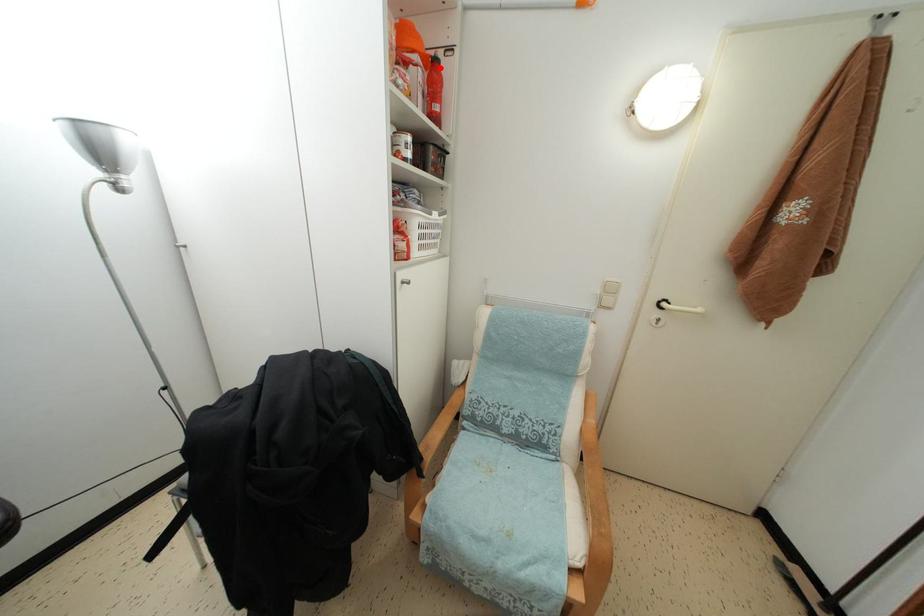
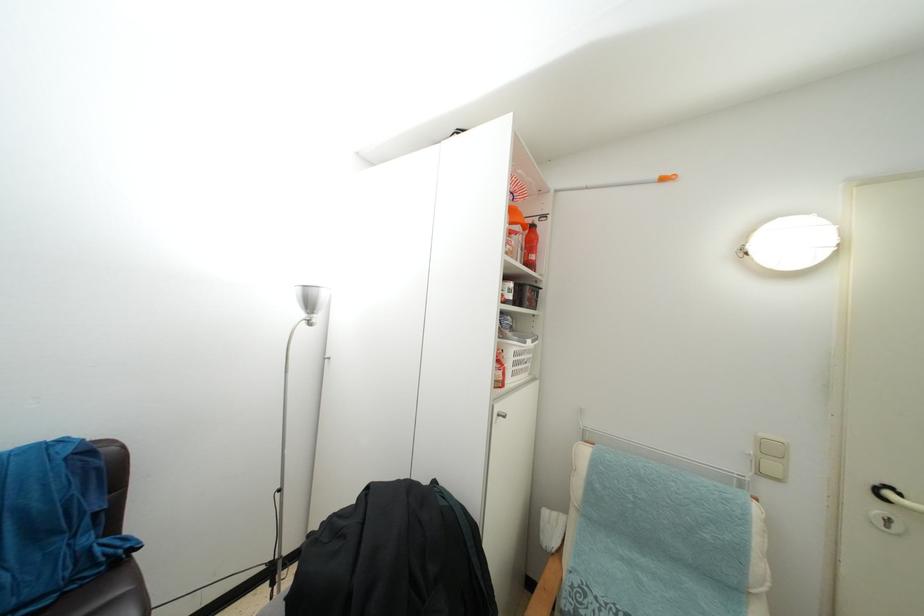
The point at the highlighted location is marked in the first image. Where is the corresponding point in the second image?

(537, 233)